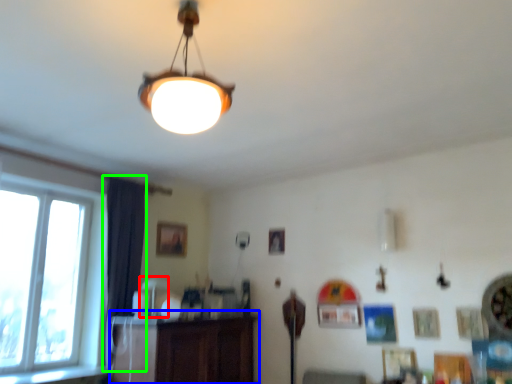
Question: Which object is the farthest from lamp (highlighted by a red box)? Choose among these: dresser (highlighted by a blue box) or curtain (highlighted by a green box).

Choices:
 (A) dresser
 (B) curtain

Answer: (A)